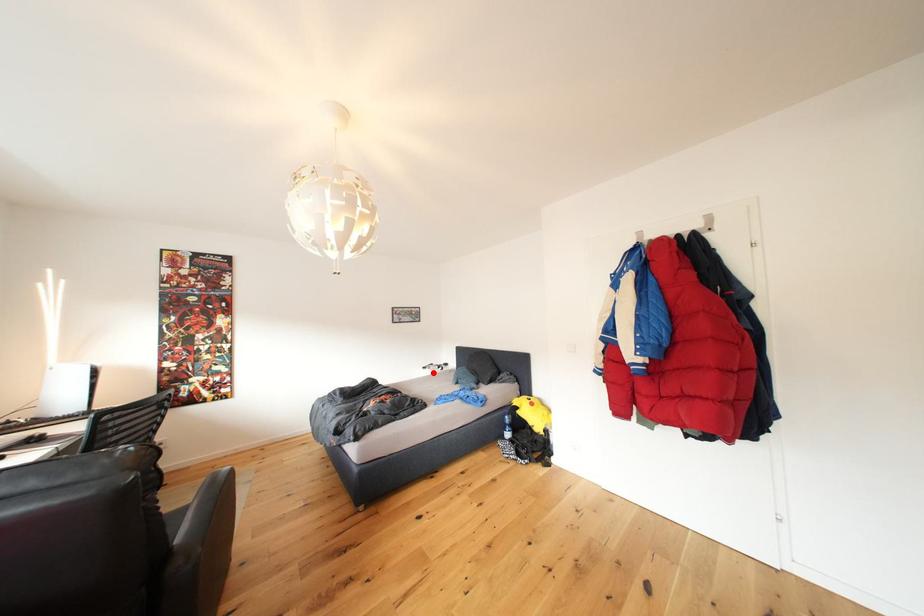
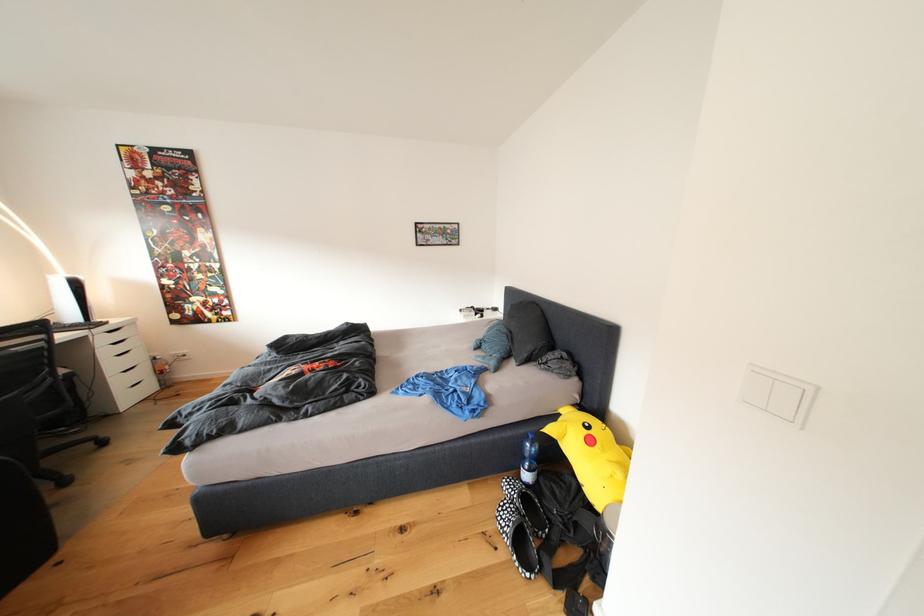
Find the pixel in the second image that matches the highlighted location in the first image.

(469, 315)